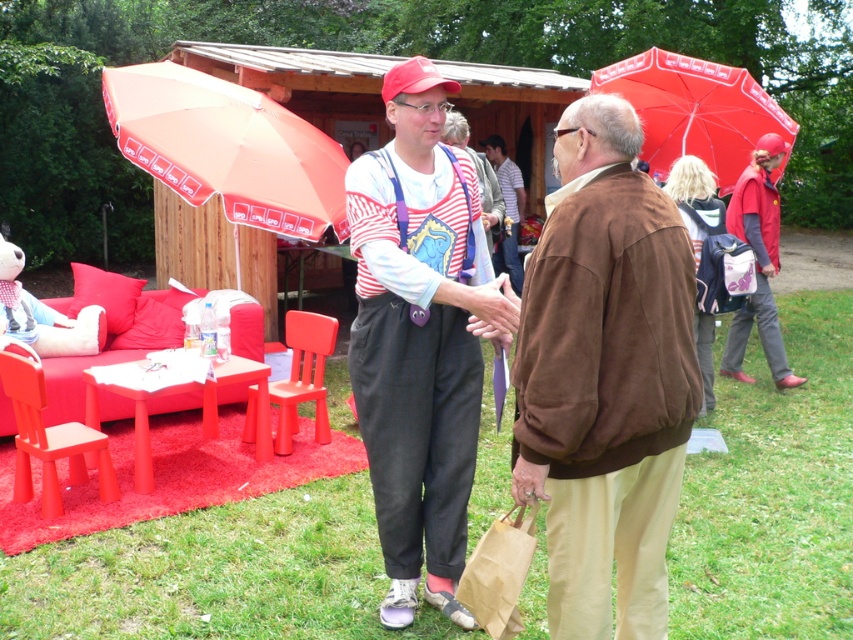
You are standing at the point with coordinates point (x=328, y=147) and want to walk towards point (x=61, y=512). Which direction should you move?

You should move away from the viewer since point (x=328, y=147) is closer to the viewer than point (x=61, y=512) according to their coordinates.